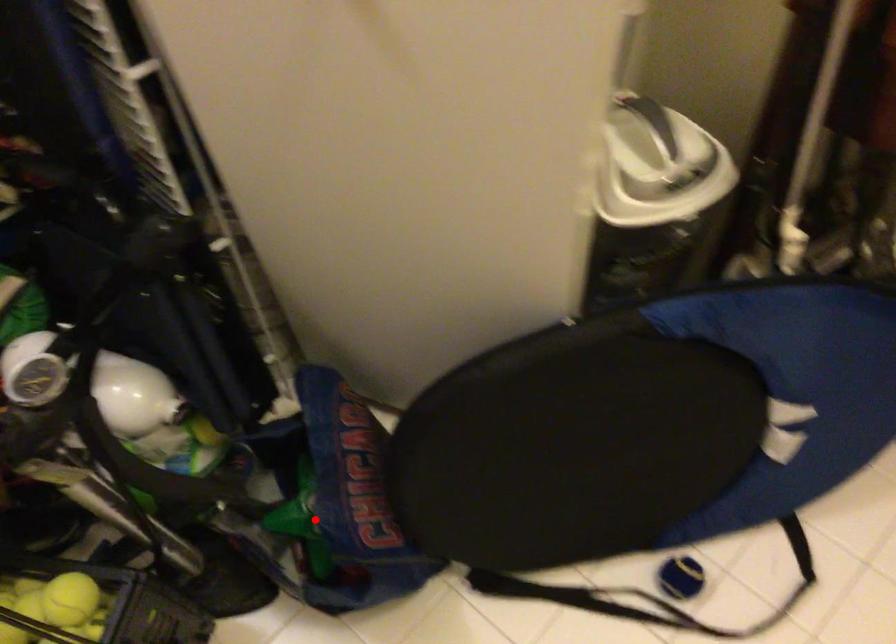
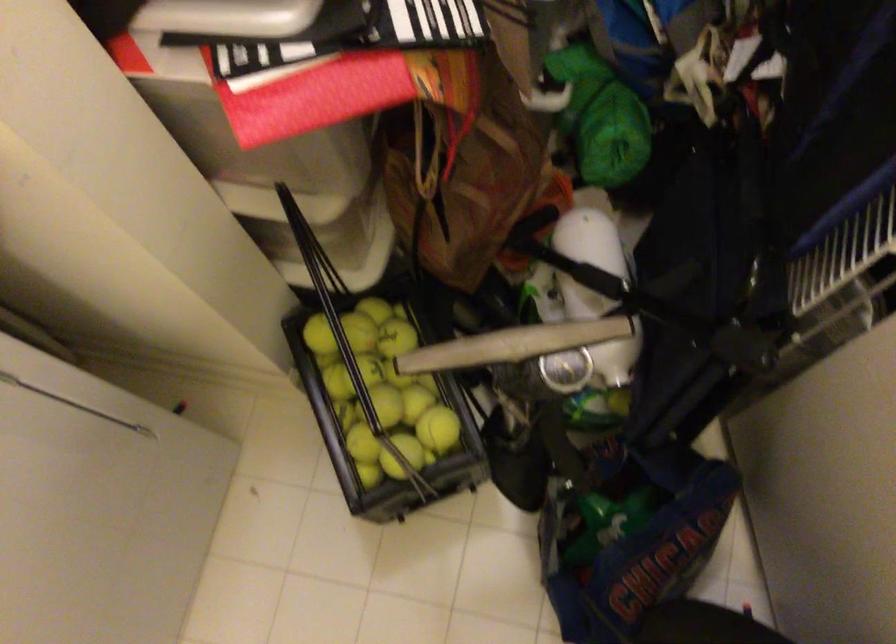
Question: I am providing you with two images of the same scene from different viewpoints. A red point is shown in image1. For the corresponding object point in image2, is it positioned nearer or farther from the camera?

Choices:
 (A) Nearer
 (B) Farther

Answer: (B)